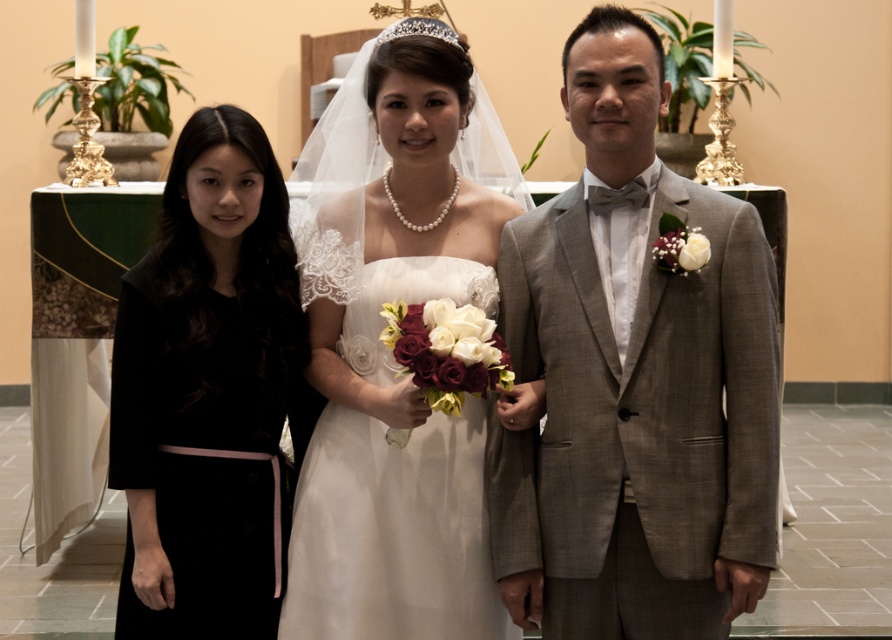
In the wedding scene, there is a black satin dress at left and a silver metallic tiara at center. From the perspective of someone standing at the back of the church, which object is positioned lower?

The black satin dress at left is located below the silver metallic tiara at center, so from the back of the church, the black satin dress at left is positioned lower.

You are a photographer adjusting your camera settings to focus on two specific points in the wedding scene. The first point is at coordinates point (261, 358) and the second is at point (403, 22). Since you can only focus on one point at a time, which point should you choose to ensure the foreground subject closer to the camera is in sharp focus?

You should focus on point (261, 358) because it is closer to the camera than point (403, 22), ensuring the foreground subject is in sharp focus.